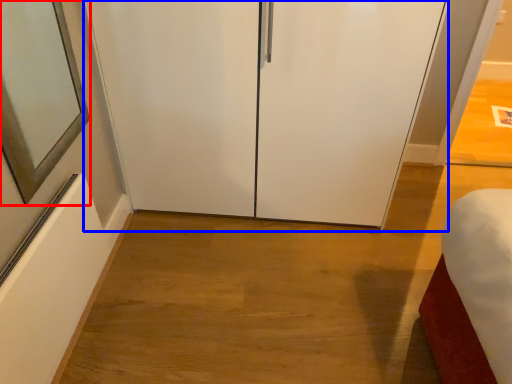
Question: Which of the following is the closest to the observer, mirror (highlighted by a red box) or glass door (highlighted by a blue box)?

Choices:
 (A) mirror
 (B) glass door

Answer: (A)